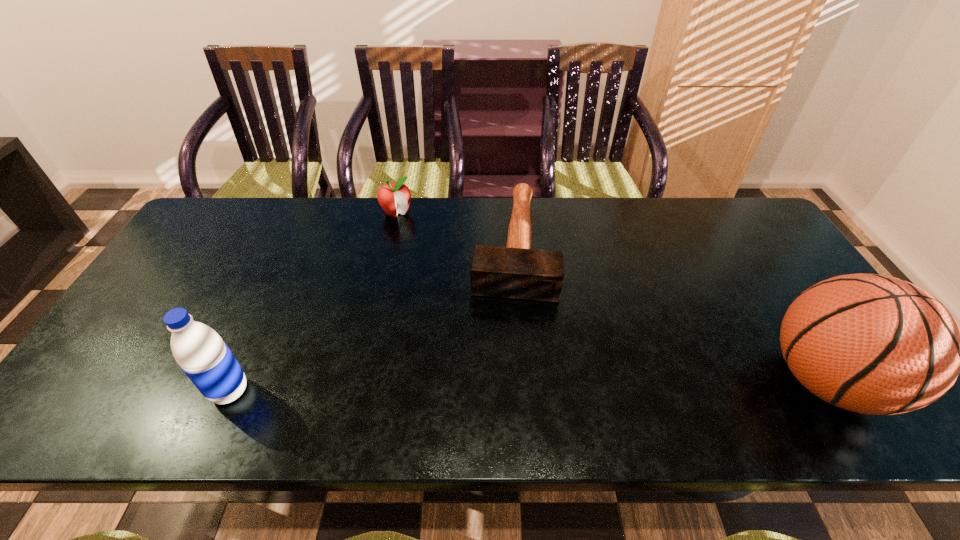
Where is `blank region between the second object from right to left and the third tallest object`? blank region between the second object from right to left and the third tallest object is located at coordinates (455, 230).

You are a GUI agent. You are given a task and a screenshot of the screen. Output one action in this format:
    pyautogui.click(x=<x>, y=<y>)
    Task: Click on the free spot between the apple and the shortest object
    The image size is (960, 540).
    Given the screenshot: What is the action you would take?
    pyautogui.click(x=455, y=230)

Identify the location of unoccupied position between the mallet and the rightmost object. This screenshot has height=540, width=960. (669, 313).

Choose which object is the nearest neighbor to the leftmost object. Please provide its 2D coordinates. Your answer should be formatted as a tuple, i.e. [(x, y)], where the tuple contains the x and y coordinates of a point satisfying the conditions above.

[(516, 271)]

Identify which object is located as the third nearest to the third tallest object. Please provide its 2D coordinates. Your answer should be formatted as a tuple, i.e. [(x, y)], where the tuple contains the x and y coordinates of a point satisfying the conditions above.

[(873, 344)]

Identify the location of vacant area that satisfies the following two spatial constraints: 1. on the back side of the basketball; 2. on the side where the inflation valve is located. (234, 381).

The height and width of the screenshot is (540, 960). I want to click on free space that satisfies the following two spatial constraints: 1. on the back side of the rightmost object; 2. on the side where the inflation valve is located, so click(x=234, y=381).

Identify the location of blank space that satisfies the following two spatial constraints: 1. on the back side of the water bottle; 2. on the side where the inflation valve is located. The width and height of the screenshot is (960, 540). (234, 381).

Identify the location of vacant area in the image that satisfies the following two spatial constraints: 1. on the front side of the second object from right to left; 2. on the side where the inflation valve is located. The height and width of the screenshot is (540, 960). (523, 381).

The image size is (960, 540). In order to click on free space that satisfies the following two spatial constraints: 1. on the front side of the mallet; 2. on the right side of the apple in this screenshot , I will do `click(390, 246)`.